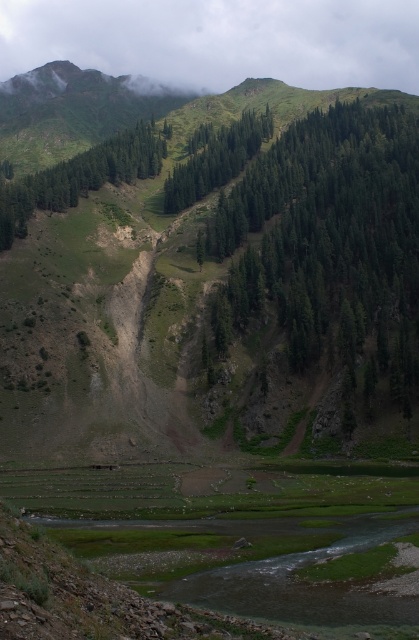
Question: From the image, what is the correct spatial relationship of cloudy green at upper center in relation to green matte tree at center?

Choices:
 (A) below
 (B) above

Answer: (B)

Question: Is green textured trees at upper center wider than green matte tree at center?

Choices:
 (A) no
 (B) yes

Answer: (B)

Question: Which object appears closest to the camera in this image?

Choices:
 (A) cloudy green at upper center
 (B) green textured trees at upper center

Answer: (B)

Question: Among these points, which one is nearest to the camera?

Choices:
 (A) (287, 212)
 (B) (38, 12)
 (C) (101, 172)

Answer: (A)

Question: Does green matte tree at upper left appear on the left side of green matte tree at center?

Choices:
 (A) no
 (B) yes

Answer: (B)

Question: Which point is closer to the camera?

Choices:
 (A) (23, 195)
 (B) (328, 269)

Answer: (B)